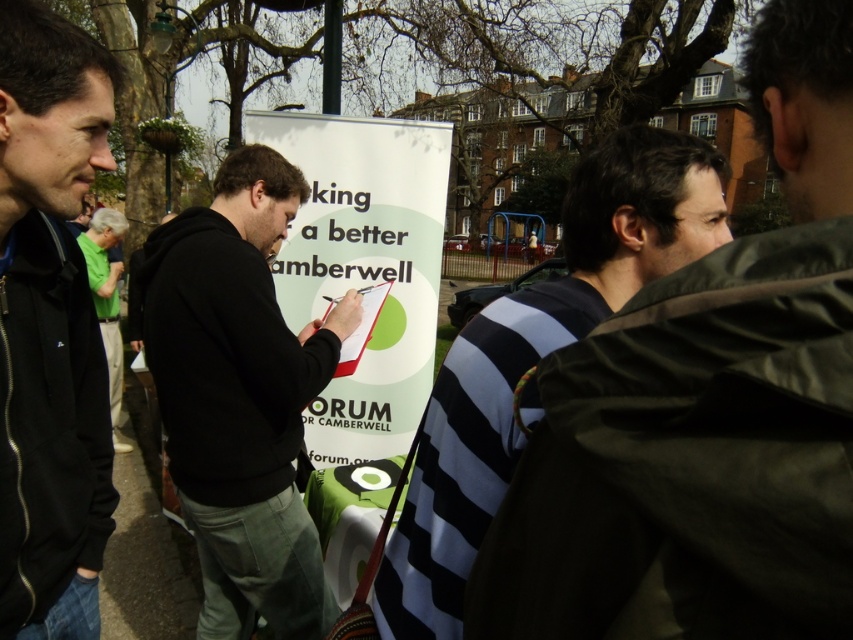
Is point (252, 396) positioned in front of point (434, 168)?

Yes, it is in front of point (434, 168).

Does black hoodie at center have a lesser width compared to white paper signboard at center?

Yes, black hoodie at center is thinner than white paper signboard at center.

Where is `black hoodie at center`? black hoodie at center is located at coordinates (241, 396).

Which of these two, white paper signboard at center or green fabric shirt at left, stands shorter?

white paper signboard at center is shorter.

Identify the location of white paper signboard at center. (364, 264).

Does dark blue jacket at left have a greater height compared to striped shirt at center?

Yes, dark blue jacket at left is taller than striped shirt at center.

Which is behind, point (68, 616) or point (653, 273)?

The point (68, 616) is more distant.

Where is `dark blue jacket at left`? This screenshot has height=640, width=853. dark blue jacket at left is located at coordinates (50, 326).